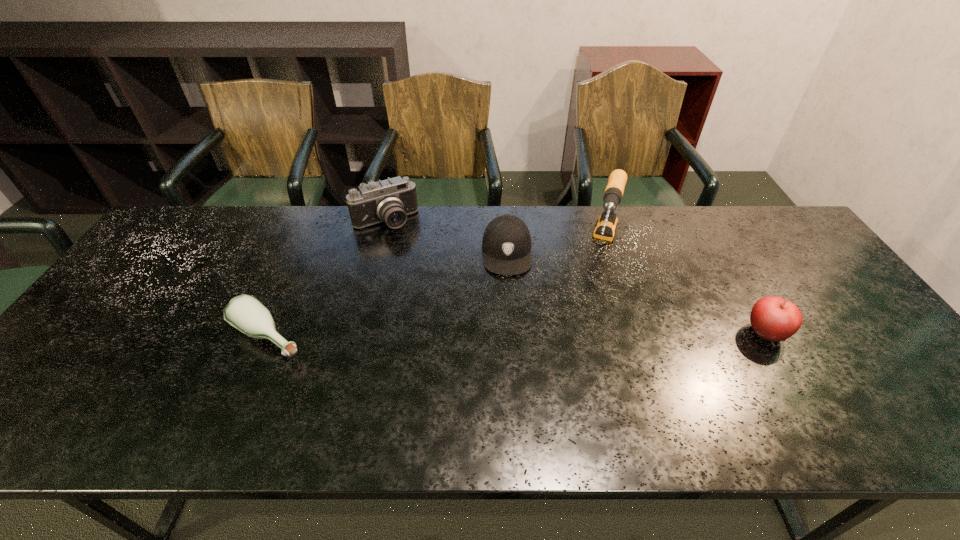
Locate an element on the screen. free space on the desktop that is between the bottle and the apple and is positioned on the front-facing side of the cap is located at coordinates (507, 335).

You are a GUI agent. You are given a task and a screenshot of the screen. Output one action in this format:
    pyautogui.click(x=<x>, y=<y>)
    Task: Click on the vacant space on the desktop that is between the leftmost object and the apple and is positioned on the handle side of the fourth object from left to right
    Image resolution: width=960 pixels, height=540 pixels.
    Given the screenshot: What is the action you would take?
    coord(578,334)

Find the location of `free space on the desktop that is between the bottle and the apple and is positioned on the front-facing side of the second object from left to right`. free space on the desktop that is between the bottle and the apple and is positioned on the front-facing side of the second object from left to right is located at coordinates (454, 335).